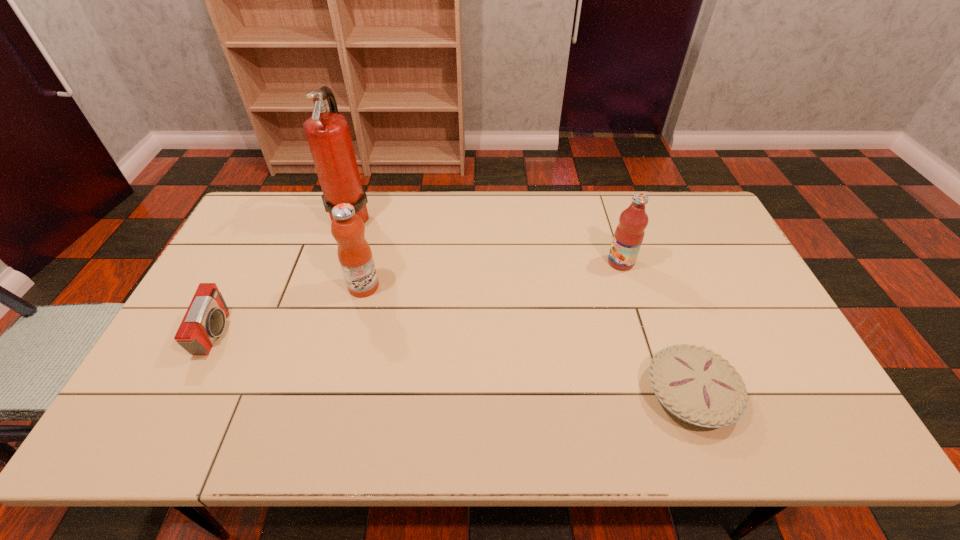
The height and width of the screenshot is (540, 960). I want to click on vacant area between the pie and the second farthest object, so click(x=656, y=328).

Where is `unoccupied position between the nearer fruit juice and the farther fruit juice`? unoccupied position between the nearer fruit juice and the farther fruit juice is located at coordinates (492, 274).

Locate an element on the screen. free space between the right fruit juice and the left fruit juice is located at coordinates (492, 274).

Where is `free space between the camera and the pie`? Image resolution: width=960 pixels, height=540 pixels. free space between the camera and the pie is located at coordinates (453, 363).

Where is `object that is the fourth closest one to the shortest object`? The width and height of the screenshot is (960, 540). object that is the fourth closest one to the shortest object is located at coordinates (205, 319).

Where is `the closest object to the shortest object`? the closest object to the shortest object is located at coordinates (629, 234).

Identify the location of vacant point that satisfies the following two spatial constraints: 1. on the front label of the nearer fruit juice; 2. on the back side of the pie. The image size is (960, 540). (337, 394).

This screenshot has height=540, width=960. I want to click on vacant area that satisfies the following two spatial constraints: 1. on the front-facing side of the pie; 2. on the right side of the camera, so click(184, 394).

The height and width of the screenshot is (540, 960). I want to click on free space that satisfies the following two spatial constraints: 1. on the front label of the shorter fruit juice; 2. on the back side of the shortest object, so click(662, 394).

This screenshot has width=960, height=540. I want to click on free region that satisfies the following two spatial constraints: 1. on the front label of the shortest object; 2. on the left side of the left fruit juice, so [337, 394].